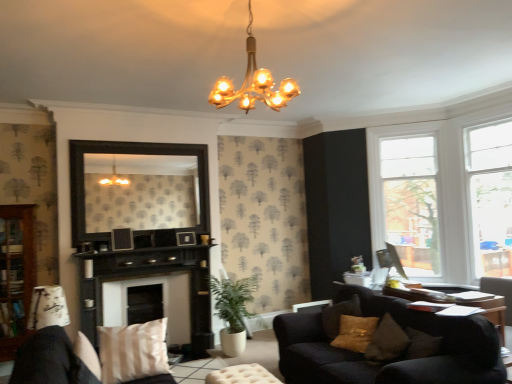
Question: Looking at their shapes, would you say dark wood mirror at center is wider or thinner than matte white lampshade at lower left, the 2th lamp from the right?

Choices:
 (A) thin
 (B) wide

Answer: (A)

Question: Looking at the image, does dark wood mirror at center seem bigger or smaller compared to matte white lampshade at lower left, which is the 2th lamp from top to bottom?

Choices:
 (A) small
 (B) big

Answer: (B)

Question: Which of these objects is positioned closest to the green leafy plant at lower center?

Choices:
 (A) beige fabric pillow at lower left
 (B) wooden bookshelf at left
 (C) tufted leather footrest at lower center
 (D) velvet dark blue couch at lower right
 (E) white wood window frame at upper right, which ranks as the 1th window frame in front-to-back order

Answer: (C)

Question: Considering the real-world distances, which object is closest to the tufted leather footrest at lower center?

Choices:
 (A) matte black picture frame at center, the second picture frame positioned from the left
 (B) beige fabric pillow at lower left
 (C) velvet dark blue couch at lower right
 (D) white wood window frame at upper right, which is counted as the second window frame, starting from the right
 (E) gold metallic chandelier at upper center, acting as the 2th lamp starting from the bottom

Answer: (B)